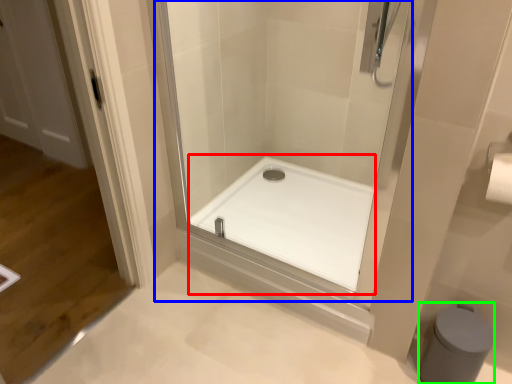
Question: Which object is positioned closest to bath (highlighted by a red box)? Select from shower door (highlighted by a blue box) and bidet (highlighted by a green box).

Choices:
 (A) shower door
 (B) bidet

Answer: (A)